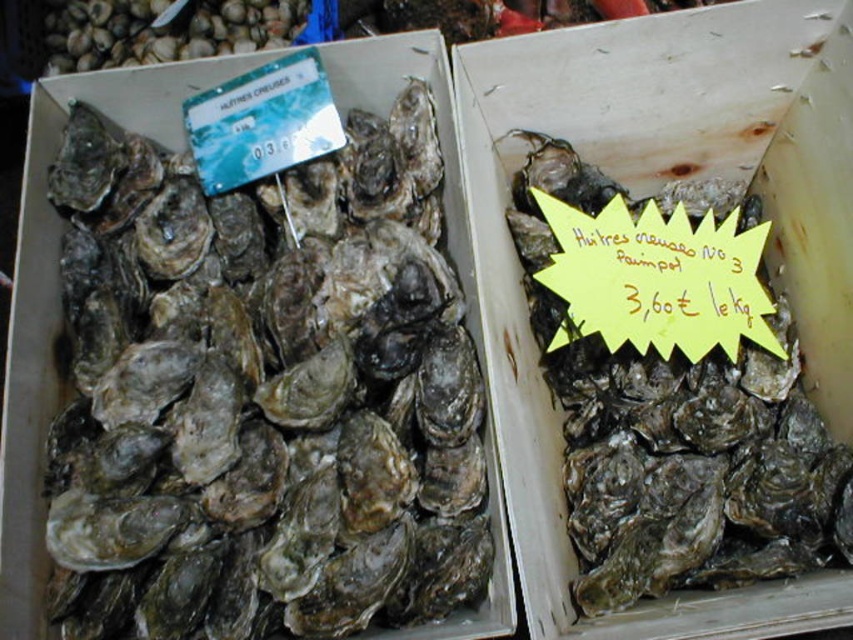
Between matte gray oyster at left and dark gray textured oyster at right, which one is positioned higher?

matte gray oyster at left

Does matte gray oyster at left appear on the left side of dark gray textured oyster at right?

Correct, you'll find matte gray oyster at left to the left of dark gray textured oyster at right.

Is point (141, 257) less distant than point (718, 214)?

Yes.

This screenshot has width=853, height=640. Identify the location of matte gray oyster at left. (265, 394).